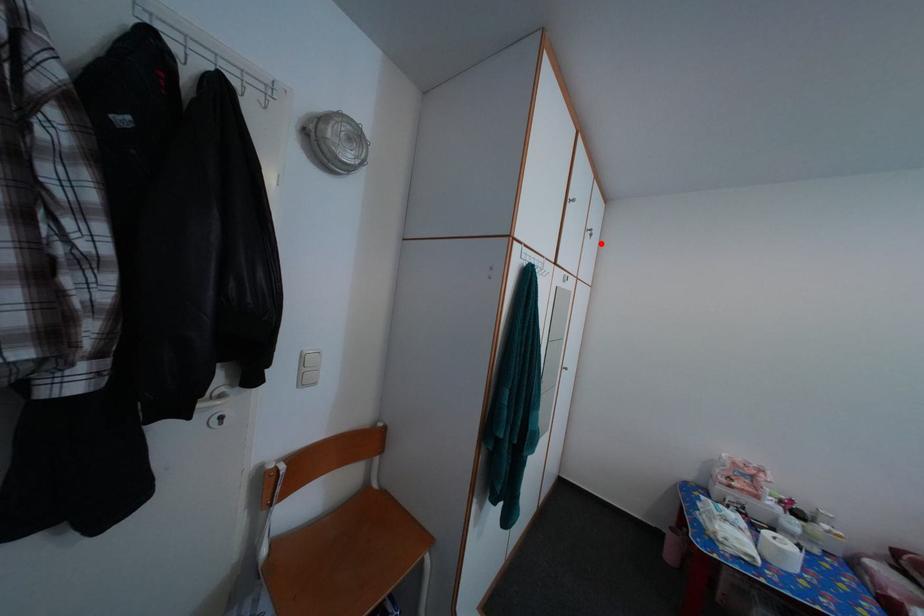
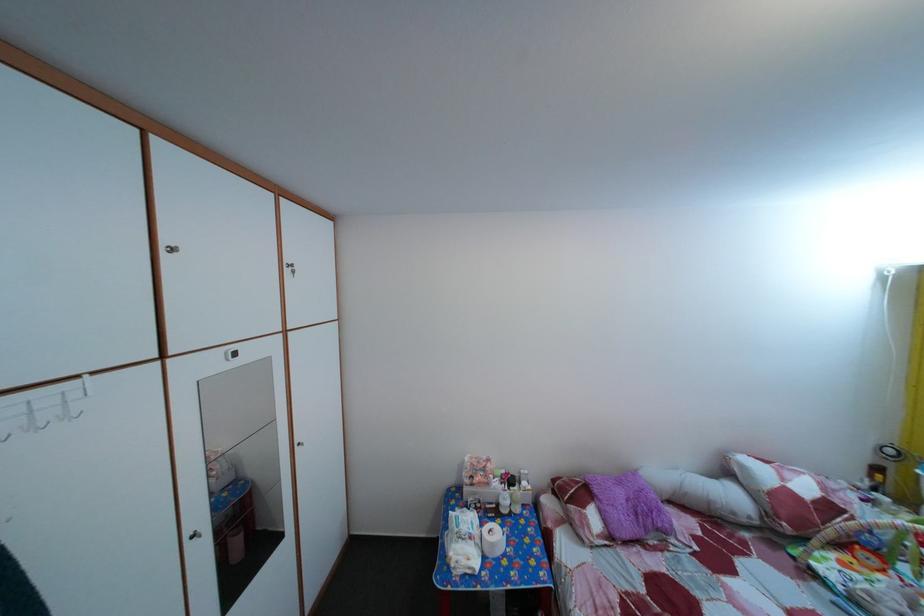
In the second image, find the point that corresponds to the highlighted location in the first image.

(304, 280)